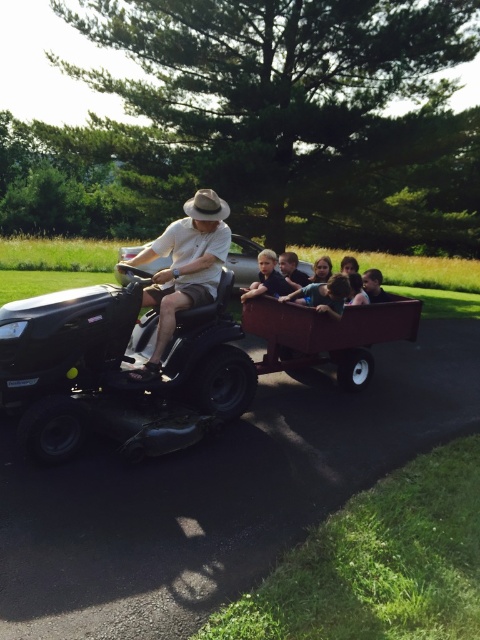
Between rustic wood wagon at center and matte black shirt at center, which one is positioned higher?

matte black shirt at center is higher up.

Between point (348, 321) and point (277, 280), which one is positioned behind?

The point (277, 280) is behind.

Describe the element at coordinates (328, 336) in the screenshot. I see `rustic wood wagon at center` at that location.

This screenshot has height=640, width=480. What are the coordinates of `rustic wood wagon at center` in the screenshot? It's located at (328, 336).

Is point (254, 333) positioned before point (196, 266)?

No, it is behind (196, 266).

Does rustic wood wagon at center come in front of matte white shirt at center?

No, rustic wood wagon at center is further to the viewer.

Is point (350, 364) closer to camera compared to point (153, 296)?

No, it is not.

I want to click on rustic wood wagon at center, so click(x=328, y=336).

Consider the image. Is matte white shirt at center bigger than matte black shirt at center?

Correct, matte white shirt at center is larger in size than matte black shirt at center.

Which is above, matte white shirt at center or matte black shirt at center?

matte black shirt at center is above.

Which is behind, point (159, 310) or point (269, 256)?

The point (269, 256) is behind.

At what (x,y) coordinates should I click in order to perform the action: click on matte white shirt at center. Please return your answer as a coordinate pair (x, y). Looking at the image, I should click on (184, 268).